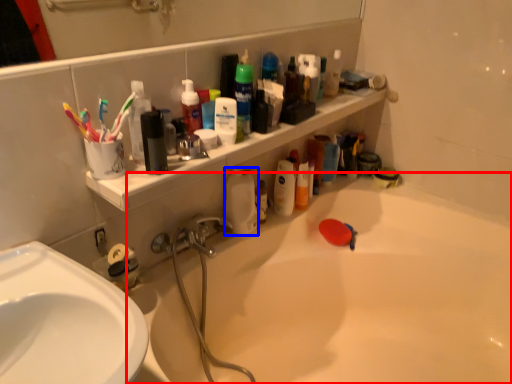
Question: Which object appears closest to the camera in this image, bathtub (highlighted by a red box) or cleaning product (highlighted by a blue box)?

Choices:
 (A) bathtub
 (B) cleaning product

Answer: (A)